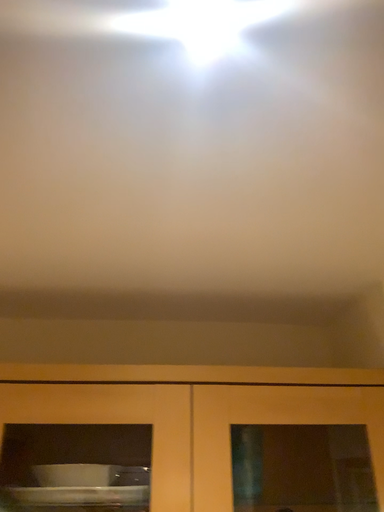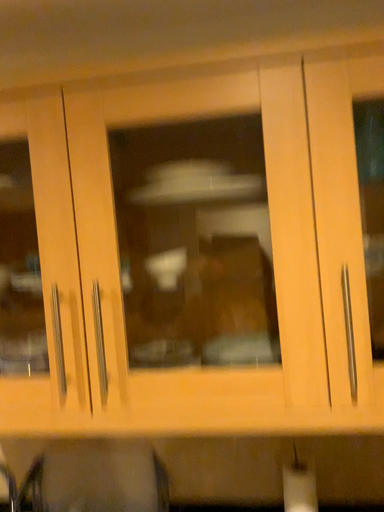
Question: How did the camera likely rotate when shooting the video?

Choices:
 (A) rotated left
 (B) rotated right

Answer: (A)